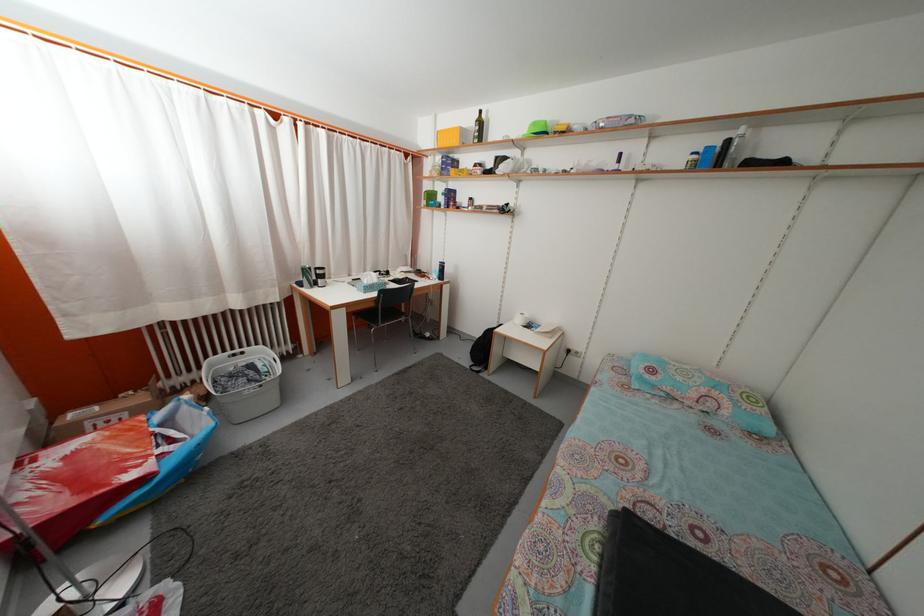
Locate an element on the screen. This screenshot has height=616, width=924. white basket handle is located at coordinates (236, 353).